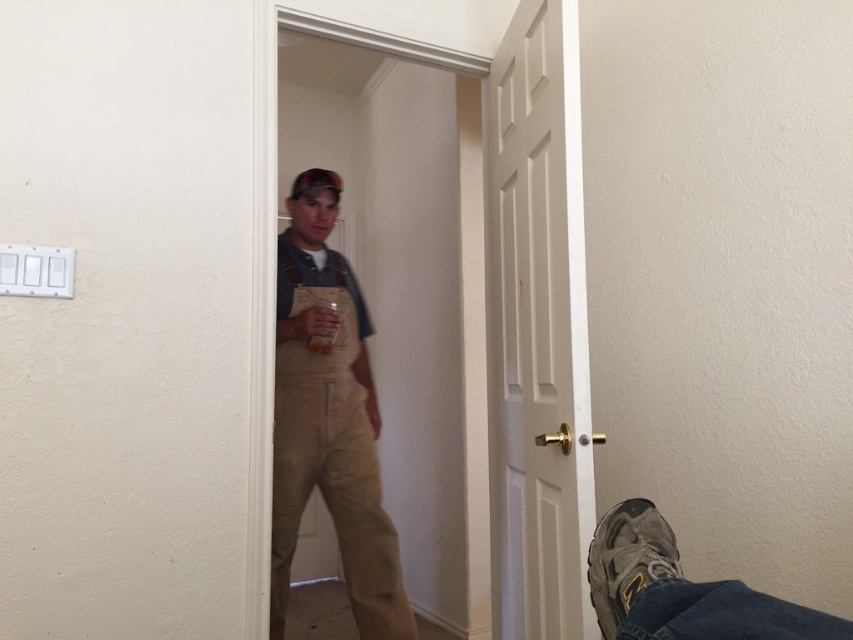
You are a delivery person holding a large package that is 1.5 meters long. You need to enter through the white matte door at center. Can you fit through the doorway without bending down or adjusting the package?

The white matte door at center is 1.39 meters away from the viewer. Since the package is 1.5 meters long, which is longer than the distance to the door, you cannot fit through the doorway without adjusting the package.